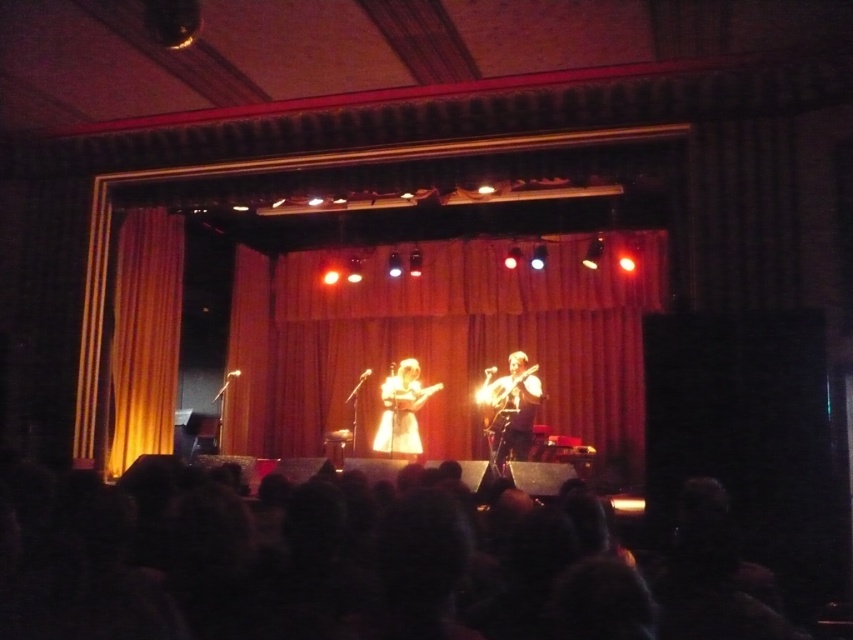
Does white fabric dress at center have a larger size compared to wooden acoustic guitar at center?

Indeed, white fabric dress at center has a larger size compared to wooden acoustic guitar at center.

Which is more to the right, white fabric dress at center or wooden acoustic guitar at center?

From the viewer's perspective, wooden acoustic guitar at center appears more on the right side.

Does point (416, 428) come farther from viewer compared to point (405, 396)?

That is True.

You are a GUI agent. You are given a task and a screenshot of the screen. Output one action in this format:
    pyautogui.click(x=<x>, y=<y>)
    Task: Click on the white fabric dress at center
    
    Given the screenshot: What is the action you would take?
    pyautogui.click(x=401, y=412)

In the scene shown: Does shiny black guitar at center have a smaller size compared to wooden acoustic guitar at center?

No, shiny black guitar at center is not smaller than wooden acoustic guitar at center.

Is shiny black guitar at center above wooden acoustic guitar at center?

No.

Between point (502, 413) and point (398, 396), which one is positioned behind?

Point (398, 396)

You are a GUI agent. You are given a task and a screenshot of the screen. Output one action in this format:
    pyautogui.click(x=<x>, y=<y>)
    Task: Click on the shiny black guitar at center
    The height and width of the screenshot is (640, 853).
    Given the screenshot: What is the action you would take?
    pyautogui.click(x=511, y=406)

Can you confirm if shiny black guitar at center is taller than white fabric dress at center?

Yes.

Is shiny black guitar at center further to camera compared to white fabric dress at center?

No.

Find the location of a particular element. Image resolution: width=853 pixels, height=640 pixels. shiny black guitar at center is located at coordinates (511, 406).

Locate an element on the screen. The width and height of the screenshot is (853, 640). shiny black guitar at center is located at coordinates (511, 406).